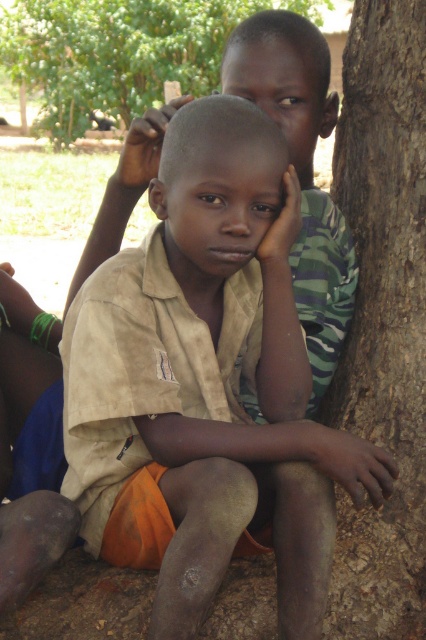
Which is below, tan cotton shirt at center or brown rough tree trunk at upper right?

tan cotton shirt at center is below.

Who is taller, tan cotton shirt at center or brown rough tree trunk at upper right?

With more height is brown rough tree trunk at upper right.

This screenshot has height=640, width=426. What are the coordinates of `tan cotton shirt at center` in the screenshot? It's located at (255, 380).

This screenshot has width=426, height=640. I want to click on tan cotton shirt at center, so click(x=255, y=380).

Is point (362, 262) in front of point (109, 113)?

That is True.

Find the location of `brown rough tree trunk at right`. brown rough tree trunk at right is located at coordinates (382, 317).

This screenshot has width=426, height=640. What are the coordinates of `brown rough tree trunk at right` in the screenshot? It's located at (382, 317).

Can you confirm if tan cotton shirt at center is shorter than brown rough tree trunk at right?

Correct, tan cotton shirt at center is not as tall as brown rough tree trunk at right.

Does tan cotton shirt at center appear on the left side of brown rough tree trunk at right?

Indeed, tan cotton shirt at center is positioned on the left side of brown rough tree trunk at right.

Is point (360, 456) farther from camera compared to point (391, 28)?

That is False.

Identify the location of tan cotton shirt at center. (255, 380).